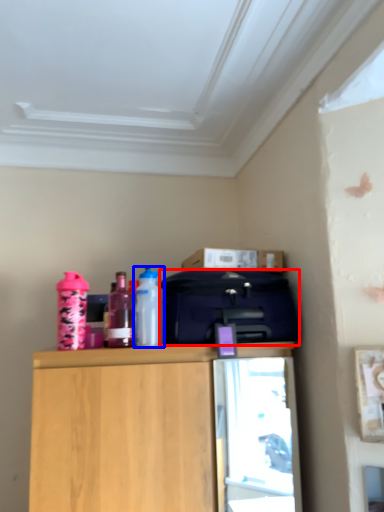
Question: Among these objects, which one is farthest to the camera, luggage (highlighted by a red box) or bottle (highlighted by a blue box)?

Choices:
 (A) luggage
 (B) bottle

Answer: (B)